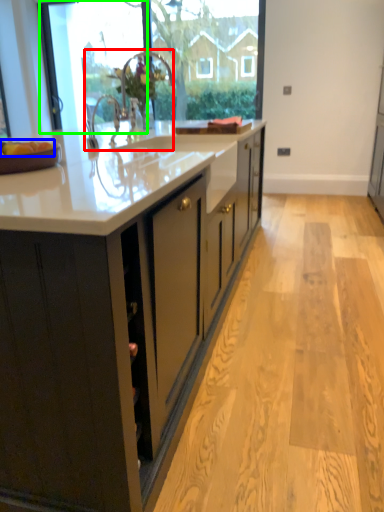
Question: Which object is positioned farthest from sink (highlighted by a red box)? Select from apple (highlighted by a blue box) and glass door (highlighted by a green box).

Choices:
 (A) apple
 (B) glass door

Answer: (A)